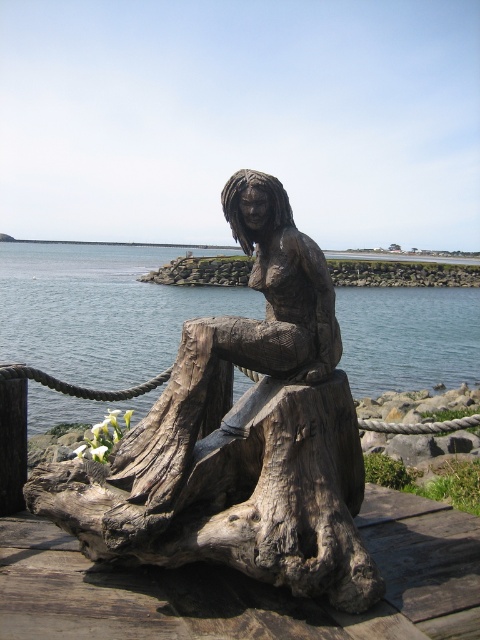
From the picture: You are standing at the edge of the water in the image. If you want to walk to the wooden statue at center, which direction should you head towards?

The wooden statue at center is located at point 0.683 on the x axis and 0.502 on the y axis. Since you are at the edge of the water, you should walk towards the direction of the statue which is in the center of the image.

You are an art curator standing in front of the wooden sculpture. You notice the wooden statue at center and the clear blue water at center. Which object is positioned lower in the image?

The wooden statue at center is located below clear blue water at center, so the wooden statue at center is positioned lower.

You are an art curator examining the sculpture and the water in the image. From your vantage point, which object is closer to you, the wooden statue at center or the clear blue water at center?

The wooden statue at center is in front of clear blue water at center, so the wooden statue at center is closer to you.